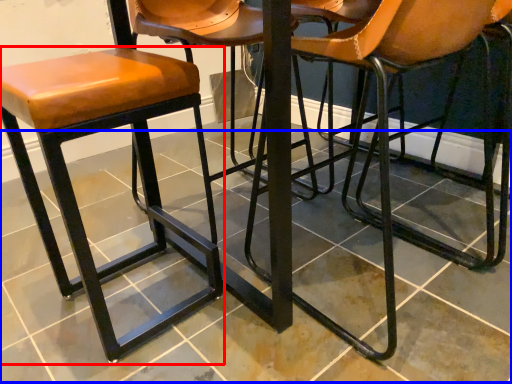
Question: Which object is closer to the camera taking this photo, stool (highlighted by a red box) or tile (highlighted by a blue box)?

Choices:
 (A) stool
 (B) tile

Answer: (B)